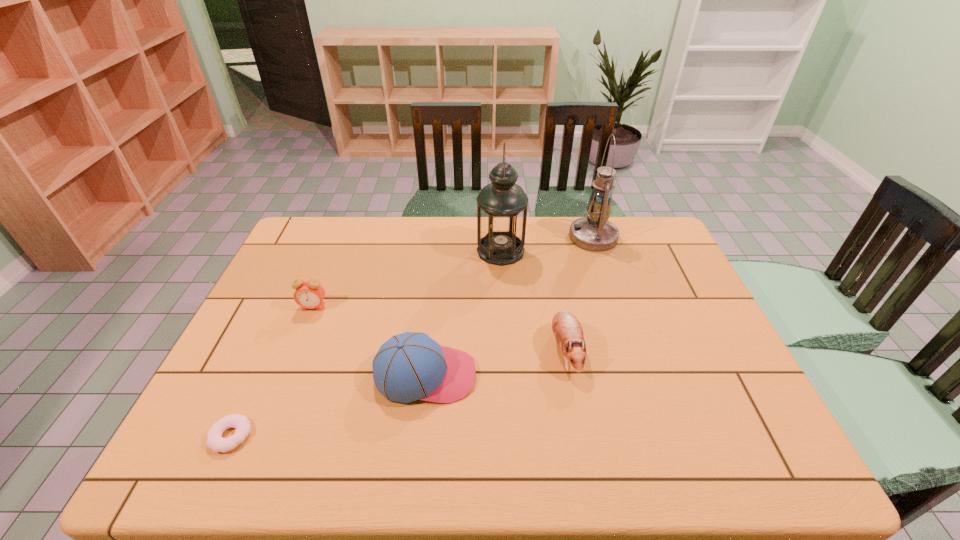
This screenshot has height=540, width=960. In order to click on empty space that is in between the second object from right to left and the alarm clock in this screenshot , I will do `click(440, 329)`.

At what (x,y) coordinates should I click in order to perform the action: click on vacant space that's between the right oil lamp and the left oil lamp. Please return your answer as a coordinate pair (x, y). The width and height of the screenshot is (960, 540). Looking at the image, I should click on (547, 244).

Identify the location of free point between the alarm clock and the baseball cap. The image size is (960, 540). (370, 341).

Identify which object is the fourth closest to the baseball cap. Please provide its 2D coordinates. Your answer should be formatted as a tuple, i.e. [(x, y)], where the tuple contains the x and y coordinates of a point satisfying the conditions above.

[(502, 205)]

Locate an element on the screen. object that can be found as the second closest to the baseball cap is located at coordinates (309, 294).

Identify the location of free space that satisfies the following two spatial constraints: 1. at the face of the hamster; 2. on the front-facing side of the baseball cap. (570, 375).